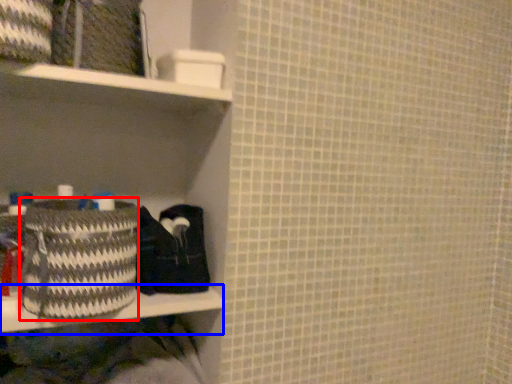
Question: Which point is closer to the camera, basket (highlighted by a red box) or ledge (highlighted by a blue box)?

Choices:
 (A) basket
 (B) ledge

Answer: (A)